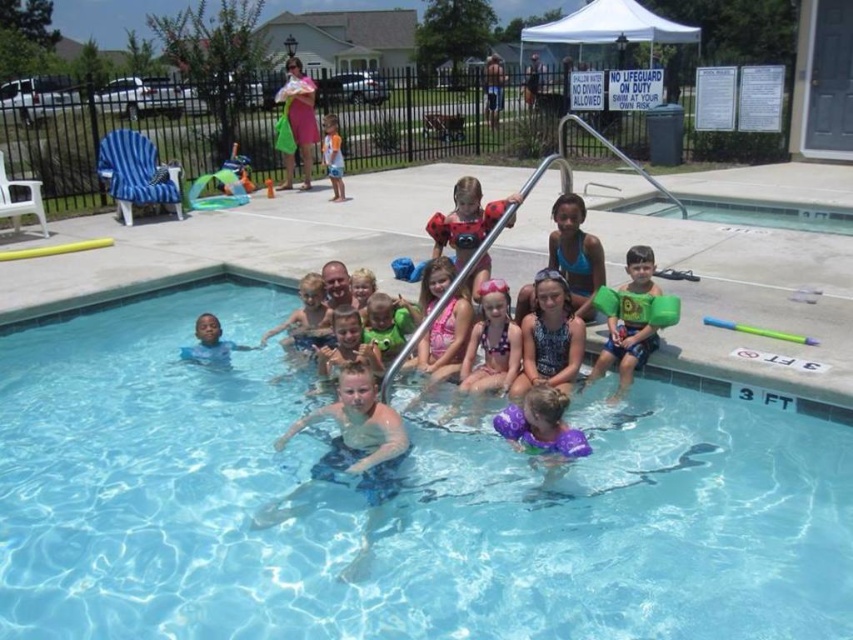
You are a photographer trying to capture a candid shot of the children in the pool area. You notice a child wearing a blue printed swimsuit at center and another child with light brown hair at center. If you want to frame both subjects in your shot, which child should you position closer to the left side of the camera frame?

The light brown hair at center should be positioned closer to the left side of the camera frame because the blue printed swimsuit at center is to the right of light brown hair at center.

You are a parent watching your child in the pool. You see the blue printed swimsuit at center and the green rubber float at center. Which object is closer to the pool water?

The blue printed swimsuit at center is located below the green rubber float at center, so it is closer to the pool water.